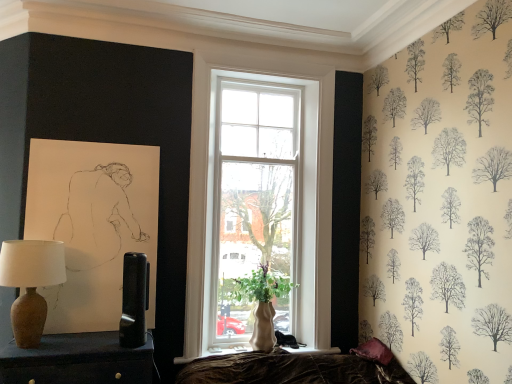
Describe the element at coordinates (262, 303) in the screenshot. I see `green matte vase at window` at that location.

The image size is (512, 384). Describe the element at coordinates (78, 361) in the screenshot. I see `matte brown lamp at left` at that location.

This screenshot has width=512, height=384. What do you see at coordinates (30, 283) in the screenshot?
I see `matte brown vase at left, placed as the second table lamp when sorted from right to left` at bounding box center [30, 283].

At what (x,y) coordinates should I click in order to perform the action: click on matte brown vase at left, arranged as the first table lamp when viewed from the left. Please return your answer as a coordinate pair (x, y). This screenshot has height=384, width=512. Looking at the image, I should click on (30, 283).

Where is `green matte vase at window`? green matte vase at window is located at coordinates (262, 303).

In order to click on table lamp behind the matte brown vase at left, arranged as the first table lamp when viewed from the left in this screenshot , I will do [x=134, y=300].

From the image's perspective, is matte brown vase at left, placed as the second table lamp when sorted from right to left, located above or below matte black table lamp at center, the second table lamp from the left?

matte brown vase at left, placed as the second table lamp when sorted from right to left, is above matte black table lamp at center, the second table lamp from the left.

Does matte brown vase at left, placed as the second table lamp when sorted from right to left, turn towards matte black table lamp at center, which is counted as the first table lamp, starting from the right?

No, matte brown vase at left, placed as the second table lamp when sorted from right to left, is not aimed at matte black table lamp at center, which is counted as the first table lamp, starting from the right.

Which is in front, matte brown vase at left, arranged as the first table lamp when viewed from the left, or matte black table lamp at center, the second table lamp from the left?

matte brown vase at left, arranged as the first table lamp when viewed from the left, is in front.

Could you tell me if green matte vase at window is facing matte brown vase at left, placed as the second table lamp when sorted from right to left?

No, green matte vase at window does not turn towards matte brown vase at left, placed as the second table lamp when sorted from right to left.

From a real-world perspective, between green matte vase at window and matte brown vase at left, placed as the second table lamp when sorted from right to left, who is vertically lower?

green matte vase at window, from a real-world perspective.

Could matte brown vase at left, placed as the second table lamp when sorted from right to left, be considered to be inside green matte vase at window?

No.

Which is nearer, (x=250, y=292) or (x=21, y=242)?

Point (x=250, y=292) is positioned farther from the camera compared to point (x=21, y=242).

The height and width of the screenshot is (384, 512). Identify the location of table lamp that is the 1st object located above the green matte vase at window (from the image's perspective). (134, 300).

Could you tell me if matte black table lamp at center, the second table lamp from the left, is facing green matte vase at window?

No, matte black table lamp at center, the second table lamp from the left, is not facing towards green matte vase at window.

Would you say matte brown lamp at left is outside matte brown vase at left, arranged as the first table lamp when viewed from the left?

Yes, matte brown lamp at left is located beyond the bounds of matte brown vase at left, arranged as the first table lamp when viewed from the left.

Who is smaller, matte brown lamp at left or matte brown vase at left, arranged as the first table lamp when viewed from the left?

matte brown vase at left, arranged as the first table lamp when viewed from the left.

Locate an element on the screen. The width and height of the screenshot is (512, 384). furniture in front of the matte brown vase at left, arranged as the first table lamp when viewed from the left is located at coordinates (78, 361).

Is green matte vase at window smaller than matte black table lamp at center, the second table lamp from the left?

Actually, green matte vase at window might be larger than matte black table lamp at center, the second table lamp from the left.

Considering the positions of objects green matte vase at window and matte black table lamp at center, which is counted as the first table lamp, starting from the right, in the image provided, who is behind, green matte vase at window or matte black table lamp at center, which is counted as the first table lamp, starting from the right,?

green matte vase at window is behind.

Locate an element on the screen. This screenshot has height=384, width=512. houseplant located below the matte black table lamp at center, the second table lamp from the left (from the image's perspective) is located at coordinates click(262, 303).

Can you confirm if green matte vase at window is wider than matte black table lamp at center, which is counted as the first table lamp, starting from the right?

Yes, green matte vase at window is wider than matte black table lamp at center, which is counted as the first table lamp, starting from the right.

From the image's perspective, relative to green matte vase at window, is velvet purple pillow at lower right above or below?

Clearly, from the image's perspective, velvet purple pillow at lower right is below green matte vase at window.

From a real-world perspective, between velvet purple pillow at lower right and green matte vase at window, who is vertically lower?

velvet purple pillow at lower right is physically lower.

Looking at their sizes, would you say velvet purple pillow at lower right is wider or thinner than green matte vase at window?

In the image, velvet purple pillow at lower right appears to be more narrow than green matte vase at window.

From the image's perspective, which is below, velvet purple pillow at lower right or matte brown lamp at left?

From the image's view, velvet purple pillow at lower right is below.

In the scene shown: Which of these two, velvet purple pillow at lower right or matte brown lamp at left, is wider?

matte brown lamp at left is wider.

Which is nearer, (376, 344) or (129, 365)?

The point (129, 365) is in front.

You are a GUI agent. You are given a task and a screenshot of the screen. Output one action in this format:
    pyautogui.click(x=<x>, y=<y>)
    Task: Click on the table lamp below the matte brown vase at left, placed as the second table lamp when sorted from right to left (from a real-world perspective)
    The width and height of the screenshot is (512, 384).
    Given the screenshot: What is the action you would take?
    pyautogui.click(x=134, y=300)

Locate an element on the screen. The height and width of the screenshot is (384, 512). houseplant on the right of the matte brown vase at left, arranged as the first table lamp when viewed from the left is located at coordinates (262, 303).

Which object lies nearer to the anchor point green matte vase at window, velvet purple pillow at lower right or matte brown lamp at left?

Among the two, velvet purple pillow at lower right is located nearer to green matte vase at window.

Estimate the real-world distances between objects in this image. Which object is further from velvet purple pillow at lower right, green matte vase at window or matte brown lamp at left?

Based on the image, matte brown lamp at left appears to be further to velvet purple pillow at lower right.

When comparing their distances from matte brown vase at left, placed as the second table lamp when sorted from right to left, does green matte vase at window or velvet purple pillow at lower right seem further?

Among the two, velvet purple pillow at lower right is located further to matte brown vase at left, placed as the second table lamp when sorted from right to left.

Looking at the image, which one is located closer to velvet purple pillow at lower right, matte brown lamp at left or green matte vase at window?

Based on the image, green matte vase at window appears to be nearer to velvet purple pillow at lower right.

Looking at the image, which one is located further to matte brown lamp at left, matte brown vase at left, placed as the second table lamp when sorted from right to left, or green matte vase at window?

green matte vase at window is positioned further to the anchor matte brown lamp at left.

Which object lies further to the anchor point matte brown lamp at left, matte black table lamp at center, which is counted as the first table lamp, starting from the right, or velvet purple pillow at lower right?

The object further to matte brown lamp at left is velvet purple pillow at lower right.

Based on their spatial positions, is matte brown vase at left, arranged as the first table lamp when viewed from the left, or green matte vase at window closer to matte black table lamp at center, which is counted as the first table lamp, starting from the right?

Based on the image, matte brown vase at left, arranged as the first table lamp when viewed from the left, appears to be nearer to matte black table lamp at center, which is counted as the first table lamp, starting from the right.

Looking at the image, which one is located further to velvet purple pillow at lower right, matte brown lamp at left or matte brown vase at left, placed as the second table lamp when sorted from right to left?

The object further to velvet purple pillow at lower right is matte brown vase at left, placed as the second table lamp when sorted from right to left.

Image resolution: width=512 pixels, height=384 pixels. I want to click on houseplant between matte black table lamp at center, the second table lamp from the left, and velvet purple pillow at lower right, in the horizontal direction, so click(x=262, y=303).

Find the location of a particular element. table lamp located between matte brown vase at left, placed as the second table lamp when sorted from right to left, and velvet purple pillow at lower right in the left-right direction is located at coordinates (134, 300).

The width and height of the screenshot is (512, 384). I want to click on furniture between matte brown vase at left, arranged as the first table lamp when viewed from the left, and matte black table lamp at center, the second table lamp from the left, in the horizontal direction, so click(x=78, y=361).

Where is `table lamp between matte brown lamp at left and green matte vase at window in the horizontal direction`? This screenshot has width=512, height=384. table lamp between matte brown lamp at left and green matte vase at window in the horizontal direction is located at coordinates (134, 300).